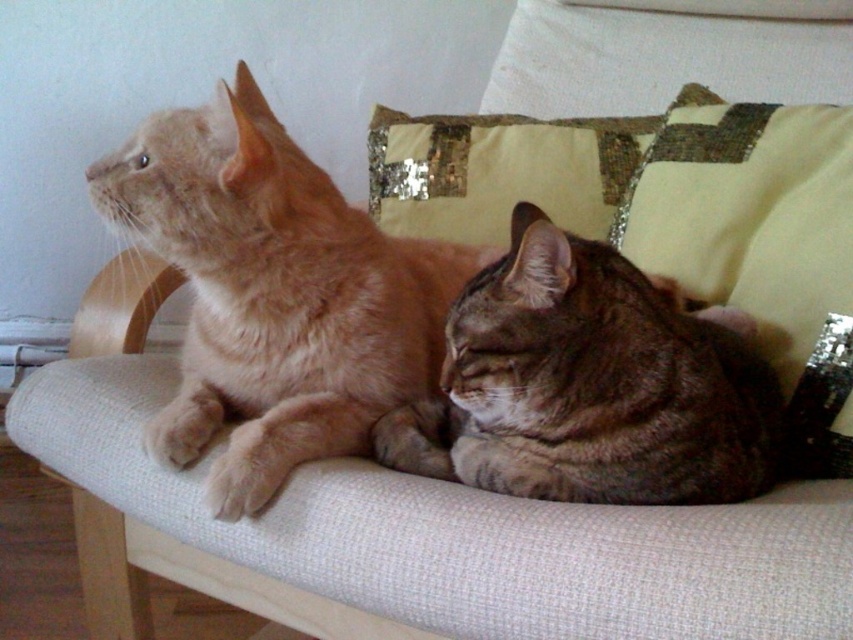
Is light brown fur cat at left closer to the viewer compared to tabby fur cat at center?

No.

Who is more distant from viewer, (190, 275) or (596, 262)?

Positioned behind is point (190, 275).

What are the coordinates of `light brown fur cat at left` in the screenshot? It's located at (276, 294).

The height and width of the screenshot is (640, 853). Identify the location of light brown fur cat at left. (276, 294).